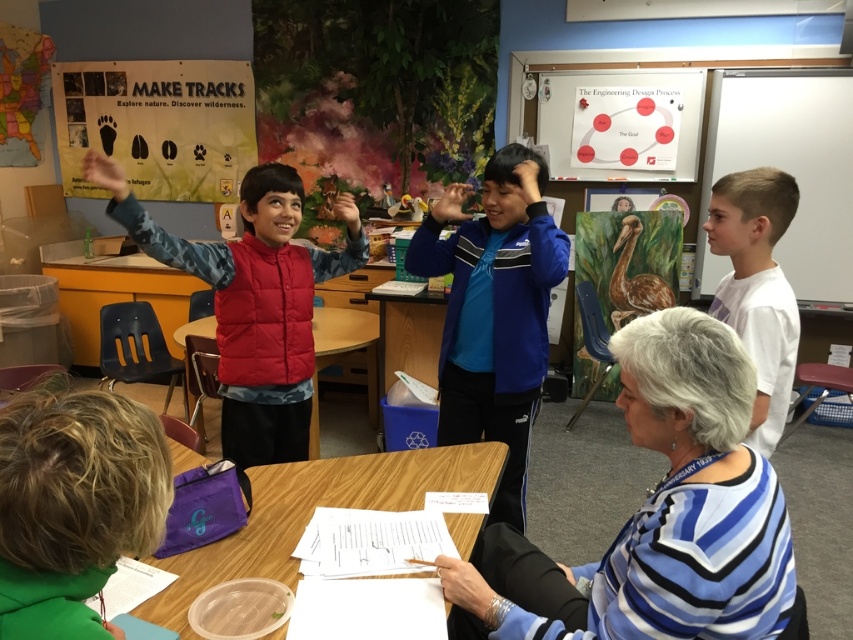
You are a teacher observing the classroom scene. You need to place a new poster between the wooden table at center and the matte red hand at upper left. Based on their positions, which object should the poster be closer to?

The wooden table at center is to the right of the matte red hand at upper left, so the poster should be placed closer to the matte red hand at upper left since it is on the left side.

You are a teacher in the classroom and want to ensure that the blue fabric jacket at center and the matte red hand at upper left can both fit on a shelf that is 1 meter wide. Based on their sizes, will they fit together?

The blue fabric jacket at center is wider than the matte red hand at upper left. Since the total width of both items combined may exceed 1 meter, it is uncertain if they will fit together without knowing the exact dimensions of each.

You are a student in the classroom and want to place a 10 cm wide book on the purple fabric table at lower center. The table has a usable surface area of 50 cm by 30 cm. Can you place the book on the table without it hanging over the edges?

The purple fabric table at lower center has a usable surface area of 50 cm by 30 cm. Since the book is only 10 cm wide, it can be placed anywhere on the table as long as its length does not exceed the table dimensions. However, the question specifies width, so the book will fit within the table dimensions. Therefore, yes, the book can be placed on the purple fabric table at lower center without hanging over the edges.